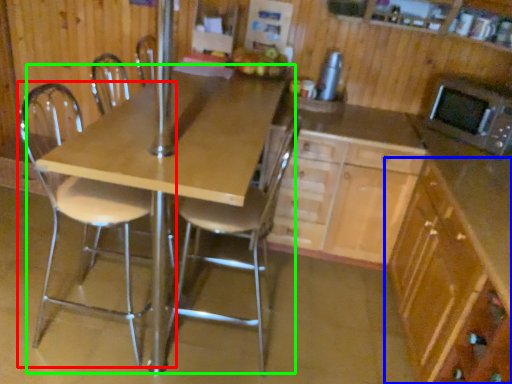
Question: Which object is the closest to the chair (highlighted by a red box)? Choose among these: cabinetry (highlighted by a blue box) or table (highlighted by a green box).

Choices:
 (A) cabinetry
 (B) table

Answer: (B)